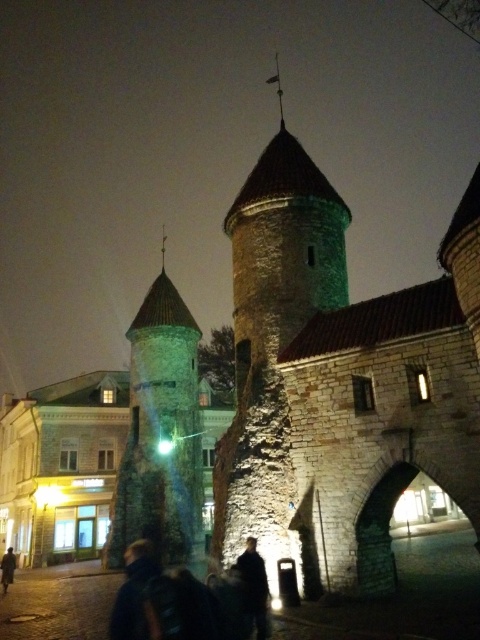
Is the position of stone tower at center less distant than that of dark fabric jacket at center?

No, it is behind dark fabric jacket at center.

Does stone tower at center have a lesser width compared to dark fabric jacket at center?

In fact, stone tower at center might be wider than dark fabric jacket at center.

Does point (304, 493) come behind point (247, 550)?

Yes, point (304, 493) is farther from viewer.

The width and height of the screenshot is (480, 640). I want to click on stone tower at center, so click(274, 342).

Between dark stone tower at center and dark fabric jacket at center, which one is positioned lower?

Positioned lower is dark fabric jacket at center.

Can you confirm if dark stone tower at center is positioned to the right of dark fabric jacket at center?

Incorrect, dark stone tower at center is not on the right side of dark fabric jacket at center.

At what (x,y) coordinates should I click in order to perform the action: click on dark stone tower at center. Please return your answer as a coordinate pair (x, y). The width and height of the screenshot is (480, 640). Looking at the image, I should click on (160, 433).

This screenshot has width=480, height=640. Identify the location of dark stone tower at center. (160, 433).

Can you confirm if dark stone tower at center is wider than dark blue jacket at lower left?

Yes, dark stone tower at center is wider than dark blue jacket at lower left.

Based on the photo, which is more to the left, dark stone tower at center or dark blue jacket at lower left?

Positioned to the left is dark stone tower at center.

Is point (168, 474) positioned before point (142, 564)?

No, (168, 474) is behind (142, 564).

Locate an element on the screen. This screenshot has width=480, height=640. dark stone tower at center is located at coordinates (160, 433).